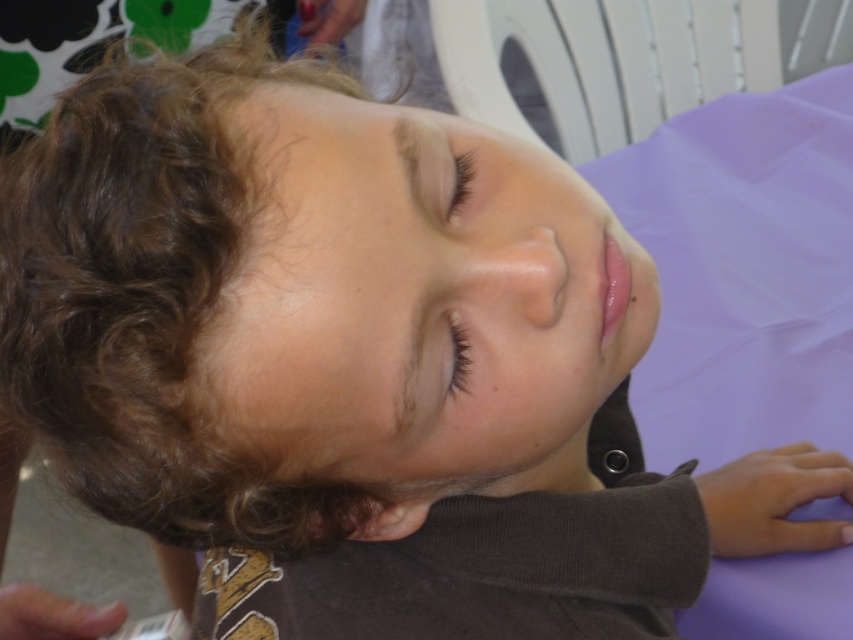
Based on the scene description, which object has a greater width between the curly brown hair at upper left and the black eyelashes at upper center?

The curly brown hair at upper left has a greater width than the black eyelashes at upper center according to the description.

You are taking a photo of the child and want to focus on the point closest to the camera. Which of the two points, point (30, 330) or point (463, 349), should you choose?

Point (30, 330) is closer to the camera than point (463, 349), so you should choose point (30, 330).

In the scene shown: You are a photographer adjusting your camera settings. You need to focus on the point at coordinates point (300, 547). The camera has a depth of field that can cover objects within 40 centimeters from the viewer. Will the point be within the camera focus range?

The point (300, 547) is 43.19 centimeters away from the viewer, which exceeds the camera depth of field range of 40 centimeters. Therefore, the point will not be within the camera focus range.